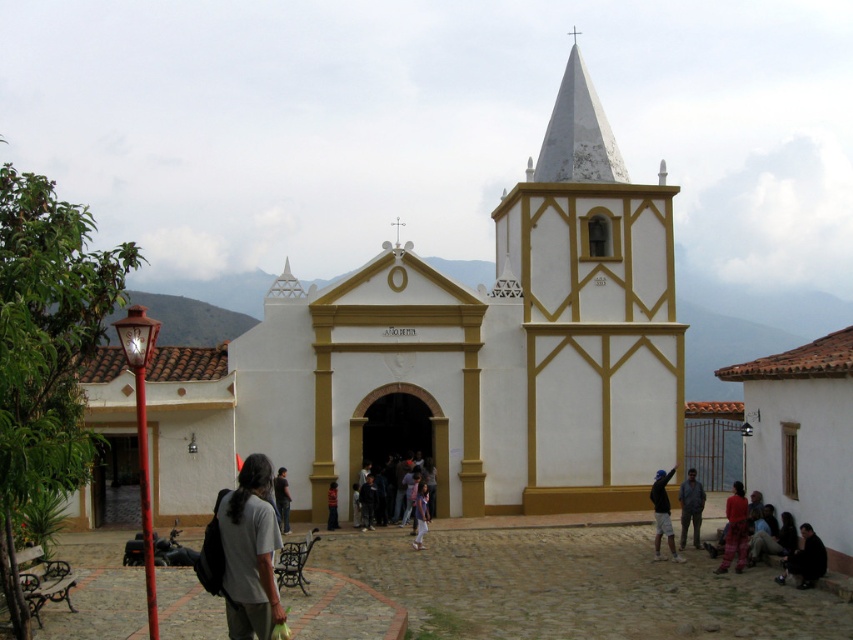
Between light brown leather shoes at center and dark gray backpack at center, which one appears on the right side from the viewer's perspective?

Positioned to the right is light brown leather shoes at center.

Can you confirm if light brown leather shoes at center is wider than dark gray backpack at center?

Yes.

I want to click on light brown leather shoes at center, so click(421, 513).

Image resolution: width=853 pixels, height=640 pixels. What are the coordinates of `dark gray fabric shirt at center` in the screenshot? It's located at (689, 508).

What do you see at coordinates (689, 508) in the screenshot? The width and height of the screenshot is (853, 640). I see `dark gray fabric shirt at center` at bounding box center [689, 508].

Locate an element on the screen. dark gray fabric shirt at center is located at coordinates (689, 508).

In order to click on dark gray fabric shirt at center in this screenshot , I will do `click(689, 508)`.

Which is behind, point (579, 160) or point (335, 515)?

Positioned behind is point (579, 160).

Who is taller, white matte spire at upper center or dark gray backpack at center?

Result: white matte spire at upper center

The height and width of the screenshot is (640, 853). In order to click on white matte spire at upper center in this screenshot , I will do `click(577, 134)`.

I want to click on white matte spire at upper center, so click(x=577, y=134).